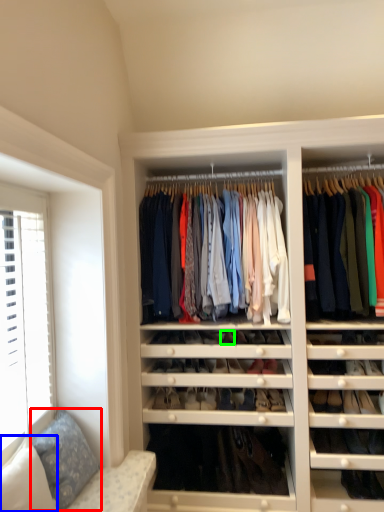
Question: Estimate the real-world distances between objects in this image. Which object is farther from pillow (highlighted by a red box), pillow (highlighted by a blue box) or shoe (highlighted by a green box)?

Choices:
 (A) pillow
 (B) shoe

Answer: (B)